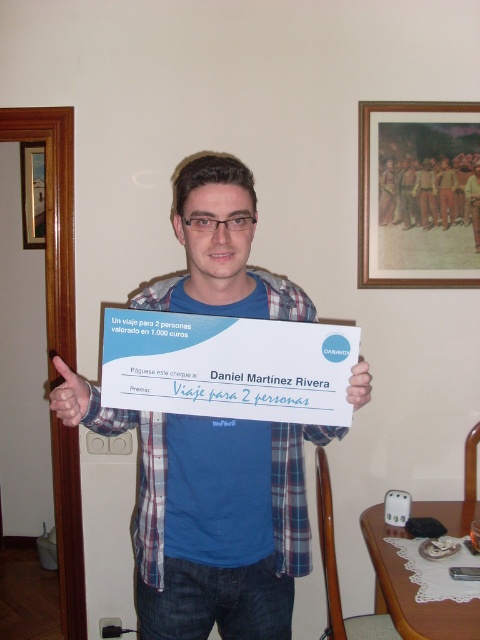
Question: Which point appears farthest from the camera in this image?

Choices:
 (A) (348, 381)
 (B) (454, 122)

Answer: (B)

Question: Can you confirm if matte blue thumb at upper left is positioned below white paper at center?

Choices:
 (A) yes
 (B) no

Answer: (A)

Question: Which of the following is the closest to the observer?

Choices:
 (A) click(x=450, y=122)
 (B) click(x=34, y=195)
 (C) click(x=288, y=548)
 (D) click(x=369, y=381)

Answer: (D)

Question: Does blue plaid shirt at center appear on the right side of matte blue thumb at upper left?

Choices:
 (A) yes
 (B) no

Answer: (A)

Question: Considering the relative positions of blue plaid shirt at center and wooden picture frame at left in the image provided, where is blue plaid shirt at center located with respect to wooden picture frame at left?

Choices:
 (A) below
 (B) above

Answer: (A)

Question: Based on their relative distances, which object is farther from the wooden picture frame at left?

Choices:
 (A) blue plaid shirt at center
 (B) wooden picture frame at upper right

Answer: (A)